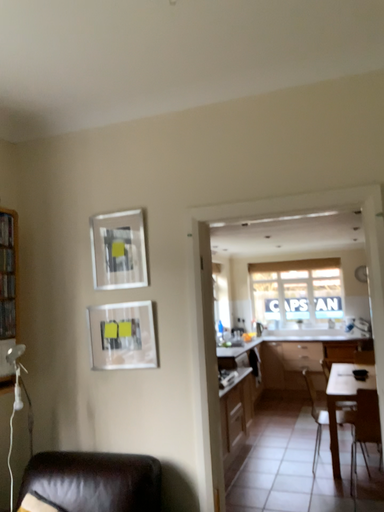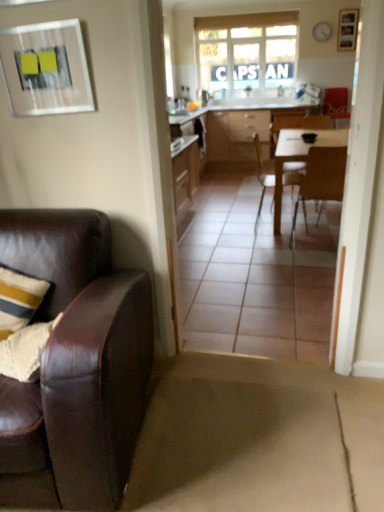
Question: Which way did the camera rotate in the video?

Choices:
 (A) rotated right
 (B) rotated left

Answer: (A)